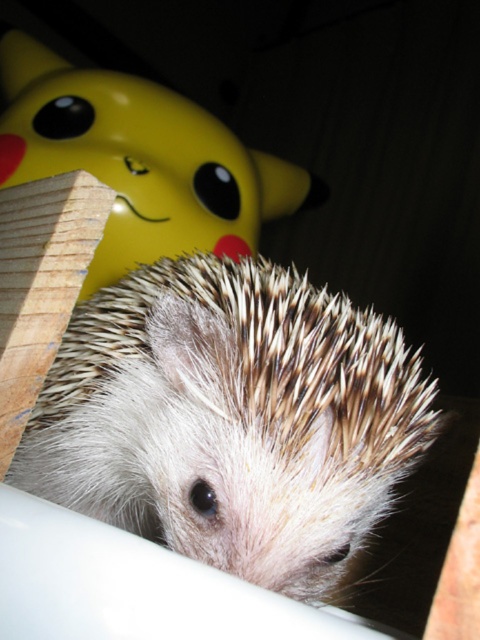
You are standing in front of the hedgehog and want to place a small treat between the two points, point (252, 570) and point (103, 132). Which point should you place the treat closer to so that it is in front of the hedgehog?

You should place the treat closer to point (252, 570) because it is in front of point (103, 132), so the treat will be in front of the hedgehog.

You are a delivery robot that needs to pick up the white spiny hedgehog at center and the yellow matte pikachu at upper left. The robot has a maximum reach distance of 36 inches. Can you reach both items without moving the robot?

The white spiny hedgehog at center and yellow matte pikachu at upper left are 38.74 inches apart, so the robot cannot reach both items without moving since the distance exceeds its 36 inches maximum reach.